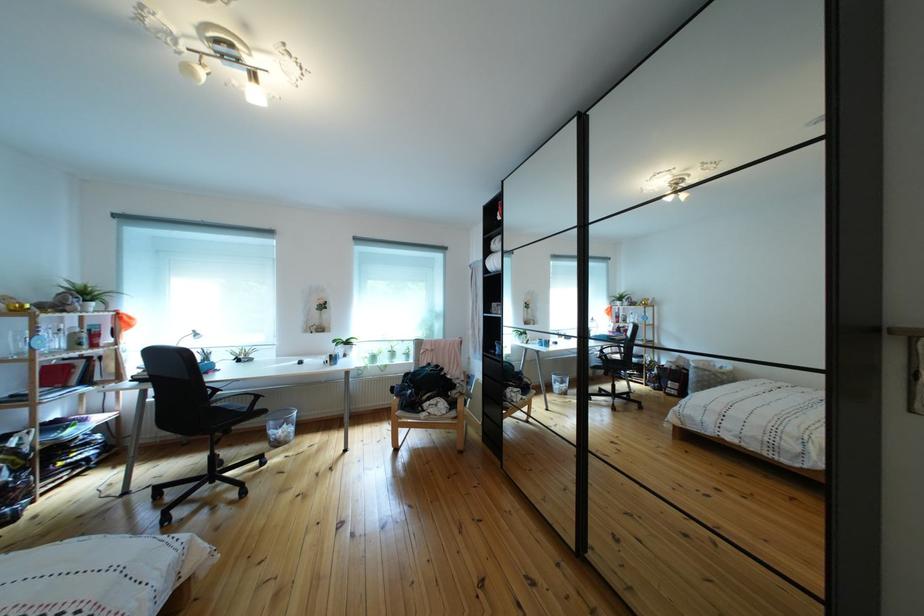
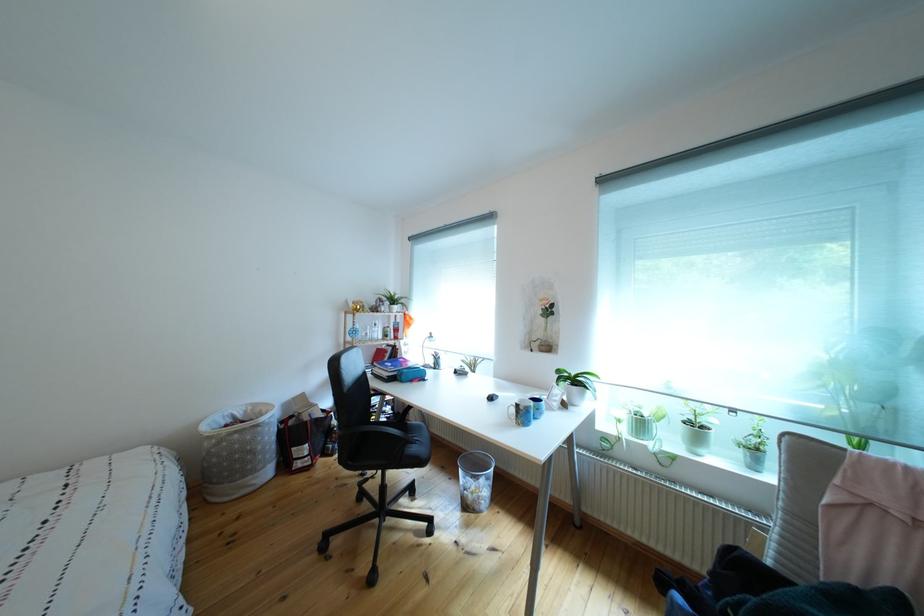
The point at (343, 362) is marked in the first image. Where is the corresponding point in the second image?

(529, 411)